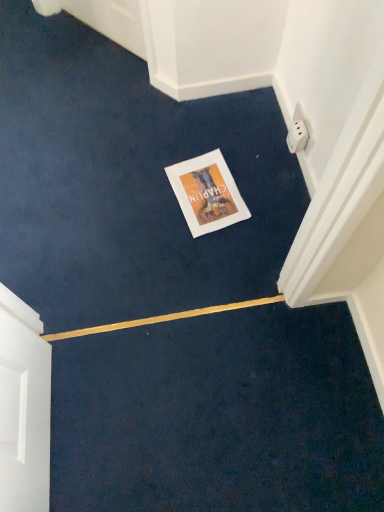
What do you see at coordinates (298, 132) in the screenshot? This screenshot has height=512, width=384. I see `white plastic electric outlet at upper right` at bounding box center [298, 132].

Find the location of `white plastic electric outlet at upper right`. white plastic electric outlet at upper right is located at coordinates (298, 132).

Identify the location of white plastic electric outlet at upper right. This screenshot has width=384, height=512. [298, 132].